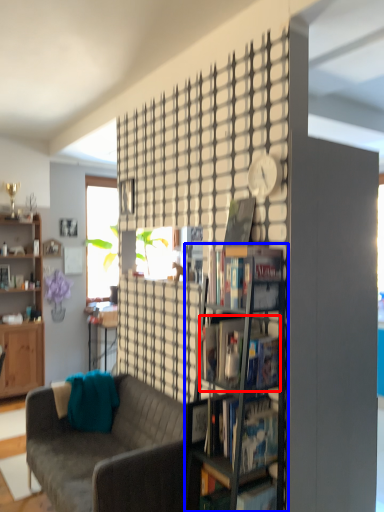
Question: Which of the following is the closest to the observer, book (highlighted by a red box) or shelf (highlighted by a blue box)?

Choices:
 (A) book
 (B) shelf

Answer: (B)